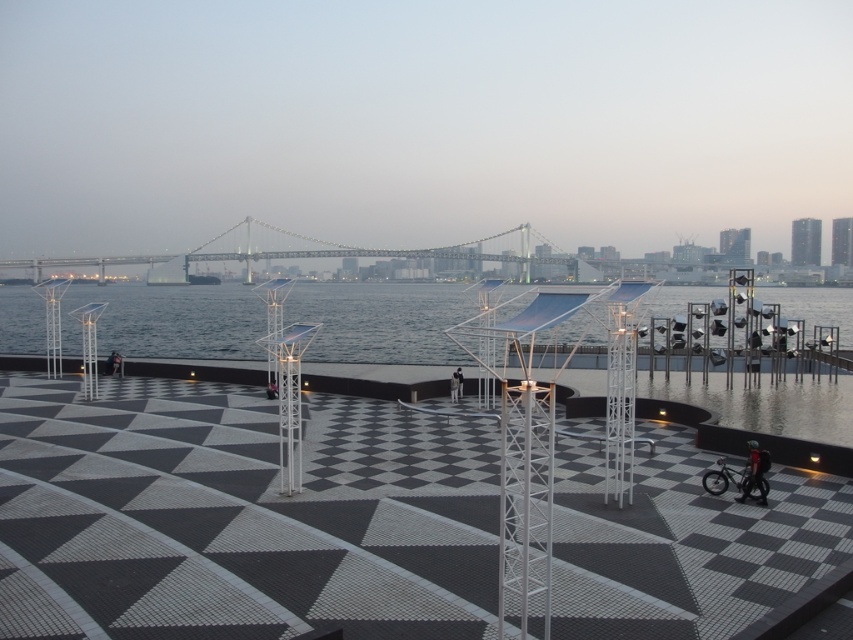
Question: Which of the following is the farthest from the observer?

Choices:
 (A) tap(459, 388)
 (B) tap(416, 248)

Answer: (B)

Question: Is transparent glass water at center to the left of dark gray fabric jacket at center from the viewer's perspective?

Choices:
 (A) yes
 (B) no

Answer: (A)

Question: Which object appears closest to the camera in this image?

Choices:
 (A) transparent glass water at center
 (B) dark blue fabric jacket at lower right
 (C) metallic gray bridge at center

Answer: (A)

Question: Which of the following is the closest to the observer?

Choices:
 (A) (762, 470)
 (B) (247, 504)

Answer: (B)

Question: Does transparent glass water at center have a smaller size compared to dark gray fabric jacket at center?

Choices:
 (A) yes
 (B) no

Answer: (B)

Question: Observing the image, what is the correct spatial positioning of metallic gray bridge at center in reference to dark gray fabric jacket at center?

Choices:
 (A) left
 (B) right

Answer: (A)